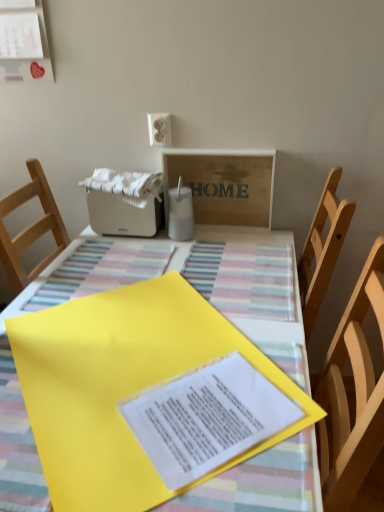
Identify the location of vacant region below wooden signboard at upper center (from a real-world perspective). This screenshot has width=384, height=512. (224, 228).